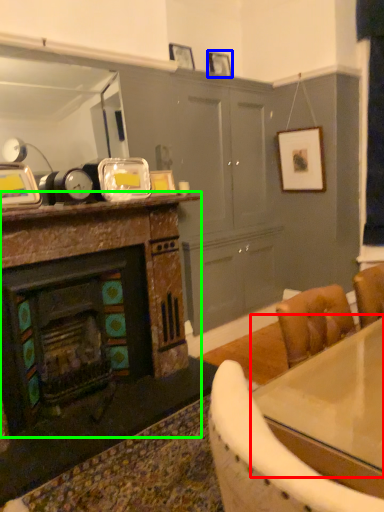
Question: Estimate the real-world distances between objects in this image. Which object is closer to counter top (highlighted by a red box), picture frame (highlighted by a blue box) or cabinetry (highlighted by a green box)?

Choices:
 (A) picture frame
 (B) cabinetry

Answer: (B)